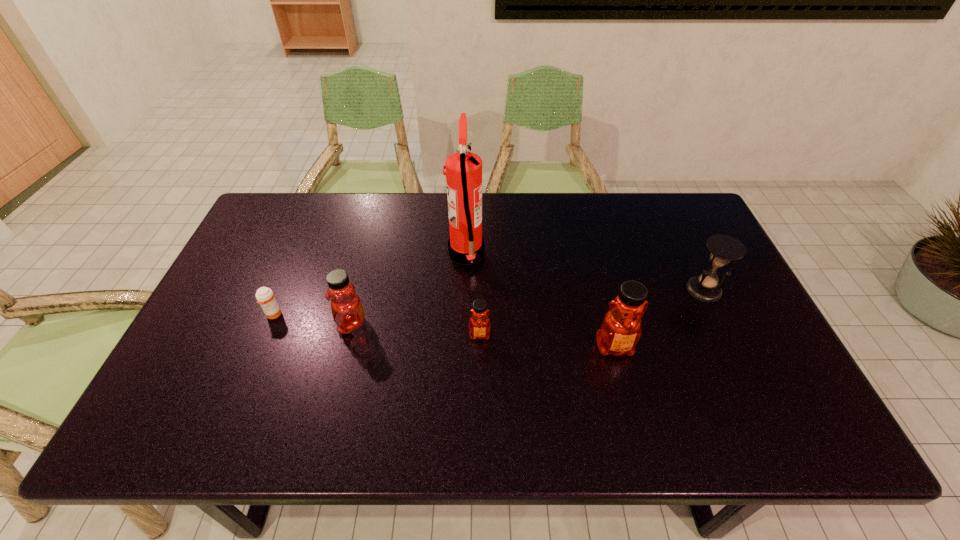
Identify the location of vacant place for an extra honey on the right. This screenshot has height=540, width=960. (756, 359).